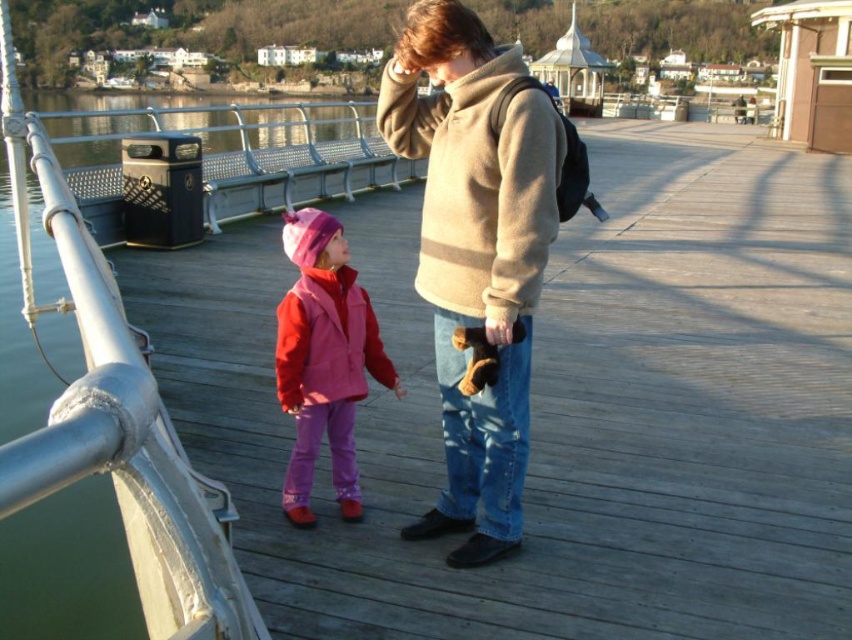
How distant is beige woolen jacket at center from pink fleece jacket at center?

They are 4.11 feet apart.

Based on the photo, is beige woolen jacket at center behind pink fleece jacket at center?

No, beige woolen jacket at center is closer to the viewer.

Does point (393, 61) come behind point (296, 339)?

That is True.

Identify the location of beige woolen jacket at center. The image size is (852, 640). (479, 186).

Who is shorter, beige woolen sweater at center or beige woolen jacket at center?

beige woolen jacket at center is shorter.

Between point (479, 52) and point (486, 224), which one is positioned in front?

Positioned in front is point (486, 224).

The height and width of the screenshot is (640, 852). Find the location of `beige woolen sweater at center`. beige woolen sweater at center is located at coordinates (476, 252).

Who is higher up, beige woolen sweater at center or pink fleece jacket at center?

beige woolen sweater at center is above.

I want to click on beige woolen sweater at center, so click(x=476, y=252).